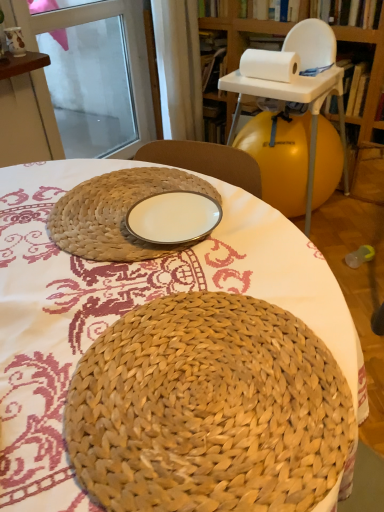
You are a GUI agent. You are given a task and a screenshot of the screen. Output one action in this format:
    pyautogui.click(x=<x>, y=<y>)
    Task: Click on the woven straw basket at center
    Image resolution: width=384 pixels, height=512 pixels.
    Given the screenshot: What is the action you would take?
    114,212

Image resolution: width=384 pixels, height=512 pixels. What do you see at coordinates (126, 42) in the screenshot? I see `transparent glass screen door at upper left` at bounding box center [126, 42].

You are a GUI agent. You are given a task and a screenshot of the screen. Output one action in this format:
    pyautogui.click(x=<x>, y=<y>)
    Task: Click on the natural woven placemat at center
    Image resolution: width=384 pixels, height=512 pixels.
    Given the screenshot: What is the action you would take?
    pyautogui.click(x=123, y=309)

The height and width of the screenshot is (512, 384). What do you see at coordinates (366, 109) in the screenshot?
I see `wooden bookshelf at upper right` at bounding box center [366, 109].

Image resolution: width=384 pixels, height=512 pixels. What are the coordinates of `woven straw basket at center` in the screenshot? It's located at (114, 212).

Which is in front, point (167, 4) or point (9, 22)?

The point (9, 22) is closer to the camera.

In terms of size, does white fabric curtain at upper center appear bigger or smaller than transparent glass screen door at upper left?

Considering their sizes, white fabric curtain at upper center takes up less space than transparent glass screen door at upper left.

Which object is positioned more to the right, white fabric curtain at upper center or transparent glass screen door at upper left?

white fabric curtain at upper center is more to the right.

Does white fabric curtain at upper center have a greater width compared to transparent glass screen door at upper left?

Correct, the width of white fabric curtain at upper center exceeds that of transparent glass screen door at upper left.

Does white glossy plate at center contain transparent glass screen door at upper left?

No, white glossy plate at center does not contain transparent glass screen door at upper left.

Where is `screen door that is under the white glossy plate at center (from a real-world perspective)`? screen door that is under the white glossy plate at center (from a real-world perspective) is located at coordinates (126, 42).

Can you confirm if white glossy plate at center is thinner than transparent glass screen door at upper left?

Incorrect, the width of white glossy plate at center is not less than that of transparent glass screen door at upper left.

Considering the relative sizes of white fabric curtain at upper center and wooden bookshelf at upper right in the image provided, is white fabric curtain at upper center taller than wooden bookshelf at upper right?

Incorrect, the height of white fabric curtain at upper center is not larger of that of wooden bookshelf at upper right.

Which is in front, point (161, 32) or point (380, 83)?

Point (380, 83)

Which of these two, white fabric curtain at upper center or wooden bookshelf at upper right, is wider?

Wider between the two is wooden bookshelf at upper right.

Is wooden bookshelf at upper right located outside woven straw basket at center?

Yes, wooden bookshelf at upper right is not within woven straw basket at center.

Looking at the image, does wooden bookshelf at upper right seem bigger or smaller compared to woven straw basket at center?

wooden bookshelf at upper right is bigger than woven straw basket at center.

Is wooden bookshelf at upper right positioned far away from woven straw basket at center?

Yes, wooden bookshelf at upper right is far from woven straw basket at center.

How different are the orientations of wooden bookshelf at upper right and woven straw basket at center in degrees?

The angle between the facing direction of wooden bookshelf at upper right and the facing direction of woven straw basket at center is 96.4 degrees.

Is point (106, 251) closer or farther from the camera than point (193, 69)?

Point (106, 251).

Which object is wider, woven straw basket at center or white fabric curtain at upper center?

woven straw basket at center.

How many degrees apart are the facing directions of woven straw basket at center and white fabric curtain at upper center?

The facing directions of woven straw basket at center and white fabric curtain at upper center are 6.47 degrees apart.

From the image's perspective, which is below, woven straw basket at center or white fabric curtain at upper center?

woven straw basket at center is shown below in the image.

Is white glossy plate at center far from natural woven placemat at center?

white glossy plate at center is near natural woven placemat at center, not far away.

Which is in front, point (203, 237) or point (41, 232)?

Point (203, 237)

Is white glossy plate at center at the left side of natural woven placemat at center?

In fact, white glossy plate at center is to the right of natural woven placemat at center.

From the picture: Considering the relative sizes of white glossy plate at center and natural woven placemat at center in the image provided, is white glossy plate at center taller than natural woven placemat at center?

No, white glossy plate at center is not taller than natural woven placemat at center.

From the image's perspective, which is below, white fabric curtain at upper center or woven straw basket at center?

From the image's view, woven straw basket at center is below.

Can you confirm if white fabric curtain at upper center is bigger than woven straw basket at center?

Yes, white fabric curtain at upper center is bigger than woven straw basket at center.

How different are the orientations of white fabric curtain at upper center and woven straw basket at center in degrees?

6.47 degrees.

Does white fabric curtain at upper center appear on the right side of woven straw basket at center?

Yes.

This screenshot has width=384, height=512. In the image, there is a white fabric curtain at upper center. In order to click on screen door below it (from a real-world perspective) in this screenshot , I will do `click(126, 42)`.

The width and height of the screenshot is (384, 512). In order to click on plate on the right of transparent glass screen door at upper left in this screenshot , I will do `click(173, 218)`.

When comparing their distances from transparent glass screen door at upper left, does woven straw basket at center or natural woven placemat at center seem closer?

woven straw basket at center is closer to transparent glass screen door at upper left.

When comparing their distances from white fabric curtain at upper center, does wooden bookshelf at upper right or white paper at upper right seem closer?

wooden bookshelf at upper right is positioned closer to the anchor white fabric curtain at upper center.

Based on their spatial positions, is natural woven placemat at center or white glossy plate at center closer to white fabric curtain at upper center?

Among the two, natural woven placemat at center is located nearer to white fabric curtain at upper center.

When comparing their distances from woven straw basket at center, does white glossy plate at center or natural woven placemat at center seem further?

The object further to woven straw basket at center is natural woven placemat at center.

From the image, which object appears to be nearer to natural woven placemat at center, wooden bookshelf at upper right or white paper at upper right?

white paper at upper right.

When comparing their distances from white glossy plate at center, does white paper at upper right or natural woven placemat at center seem closer?

Based on the image, natural woven placemat at center appears to be nearer to white glossy plate at center.

Looking at the image, which one is located closer to white fabric curtain at upper center, woven straw basket at center or white paper at upper right?

Based on the image, white paper at upper right appears to be nearer to white fabric curtain at upper center.

Estimate the real-world distances between objects in this image. Which object is further from white glossy plate at center, woven straw basket at center or transparent glass screen door at upper left?

transparent glass screen door at upper left is positioned further to the anchor white glossy plate at center.

This screenshot has width=384, height=512. I want to click on screen door between natural woven placemat at center and white fabric curtain at upper center in the front-back direction, so click(126, 42).

Identify the location of bookshelf located between natural woven placemat at center and white paper at upper right in the depth direction. click(x=366, y=109).

Locate an element on the screen. paper towel located between white glossy plate at center and transparent glass screen door at upper left in the depth direction is located at coordinates (270, 65).

Locate an element on the screen. The width and height of the screenshot is (384, 512). basket located between natural woven placemat at center and white glossy plate at center in the depth direction is located at coordinates (114, 212).